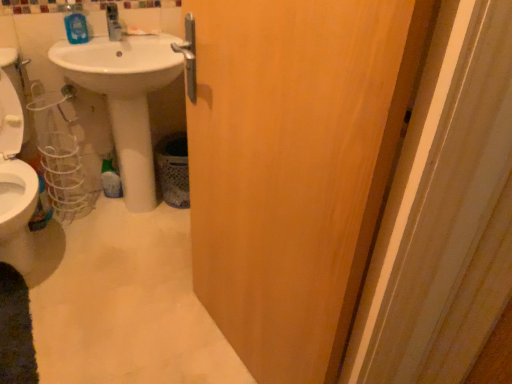
Question: Is white glossy sink at center taller or shorter than wooden door at center?

Choices:
 (A) tall
 (B) short

Answer: (B)

Question: In terms of size, does white glossy sink at center appear bigger or smaller than wooden door at center?

Choices:
 (A) big
 (B) small

Answer: (A)

Question: Estimate the real-world distances between objects in this image. Which object is farther from the white glossy sink at center?

Choices:
 (A) wooden door at center
 (B) blue glossy mouthwash at upper left

Answer: (A)

Question: Which object is positioned farthest from the blue glossy mouthwash at upper left?

Choices:
 (A) white glossy sink at center
 (B) wooden door at center

Answer: (B)